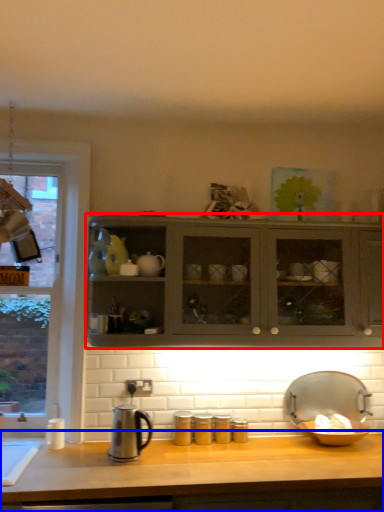
Question: Which point is further to the camera, cabinetry (highlighted by a red box) or countertop (highlighted by a blue box)?

Choices:
 (A) cabinetry
 (B) countertop

Answer: (A)